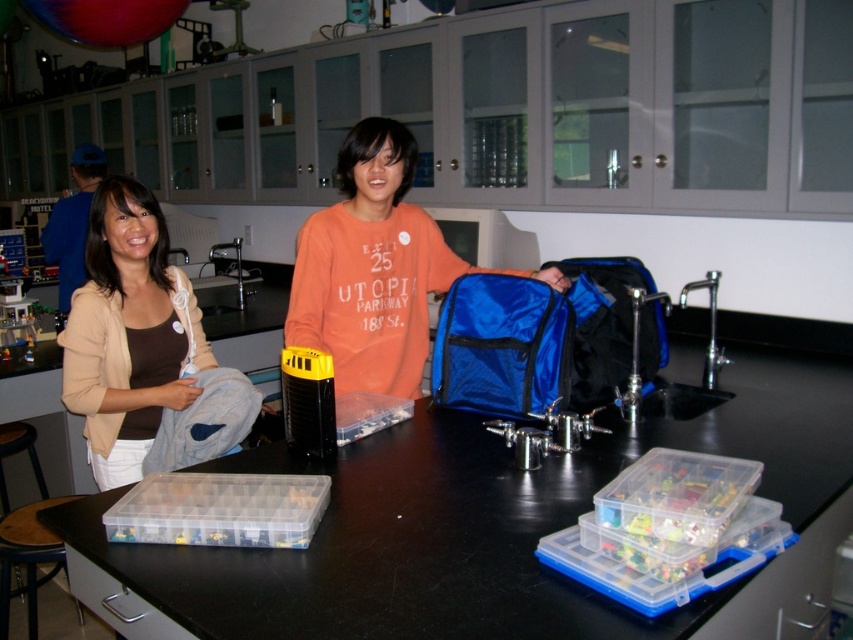
Question: Is orange cotton shirt at center further to camera compared to beige soft sweater at left?

Choices:
 (A) yes
 (B) no

Answer: (A)

Question: Which of the following is the farthest from the observer?

Choices:
 (A) (450, 568)
 (B) (190, 385)
 (C) (32, 516)

Answer: (C)

Question: Which of these objects is positioned closest to the clear plastic table at center?

Choices:
 (A) beige soft sweater at left
 (B) orange cotton shirt at center

Answer: (B)

Question: Is clear plastic table at center to the left of orange cotton shirt at center from the viewer's perspective?

Choices:
 (A) no
 (B) yes

Answer: (A)

Question: From the image, what is the correct spatial relationship of clear plastic table at center in relation to orange cotton shirt at center?

Choices:
 (A) right
 (B) left

Answer: (A)

Question: Which point is closer to the camera taking this photo?

Choices:
 (A) (114, 394)
 (B) (357, 273)

Answer: (A)